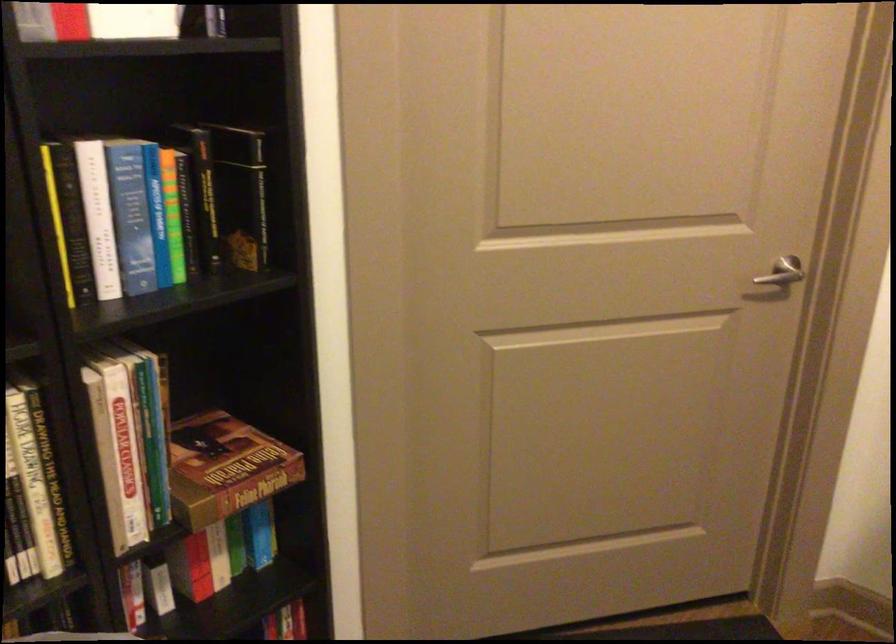
Which object does [240,194] point to?

It refers to a black spine book.